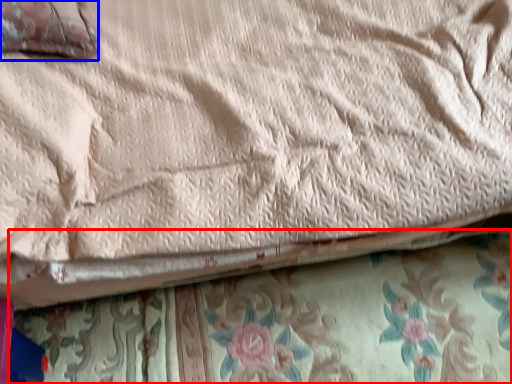
Question: Among these objects, which one is nearest to the camera, blanket (highlighted by a red box) or pillow (highlighted by a blue box)?

Choices:
 (A) blanket
 (B) pillow

Answer: (B)